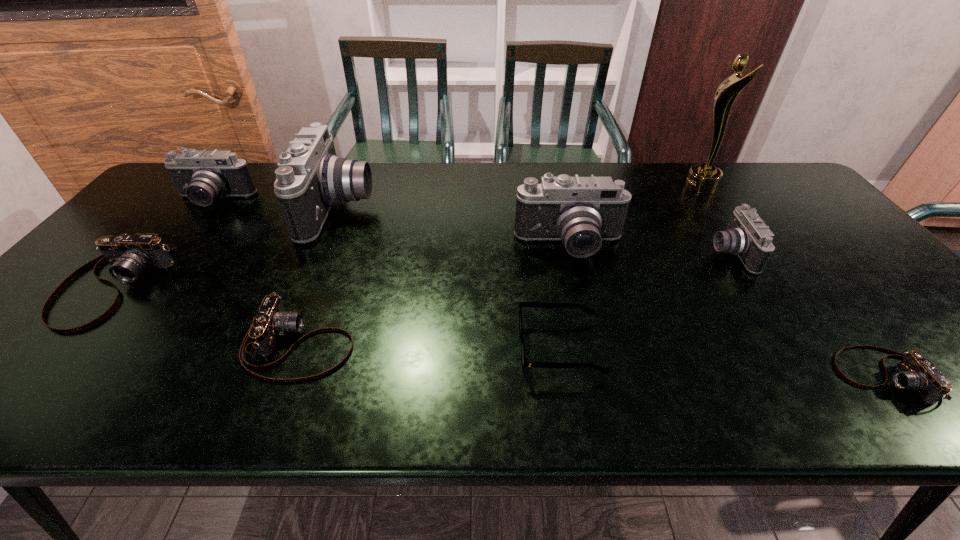
At what (x,y) coordinates should I click in order to perform the action: click on vacant space situated 0.350m on the front-facing side of the third black camera from left to right. Please return your answer as a coordinate pair (x, y). The width and height of the screenshot is (960, 540). Looking at the image, I should click on (602, 382).

Where is `vacant space located 0.390m on the front-facing side of the leftmost black camera`? Image resolution: width=960 pixels, height=540 pixels. vacant space located 0.390m on the front-facing side of the leftmost black camera is located at coordinates (129, 308).

Image resolution: width=960 pixels, height=540 pixels. Find the location of `free space located on the front-facing side of the fifth tallest object`. free space located on the front-facing side of the fifth tallest object is located at coordinates (637, 253).

I want to click on vacant space located on the front-facing side of the fifth tallest object, so click(675, 253).

Where is `vacant space located 0.130m on the front-facing side of the fifth tallest object`? vacant space located 0.130m on the front-facing side of the fifth tallest object is located at coordinates (663, 253).

Identify the location of vacant space located 0.180m on the front-facing side of the fifth tallest camera. This screenshot has height=540, width=960. (10, 405).

Where is `free space located on the front-facing side of the second brown camera from right to left`? free space located on the front-facing side of the second brown camera from right to left is located at coordinates (519, 344).

This screenshot has height=540, width=960. I want to click on vacant space located 0.120m on the arms of the black spectacles, so click(x=465, y=348).

The height and width of the screenshot is (540, 960). I want to click on vacant space located on the arms of the black spectacles, so click(349, 348).

This screenshot has width=960, height=540. I want to click on blank area located 0.210m on the arms of the black spectacles, so click(423, 348).